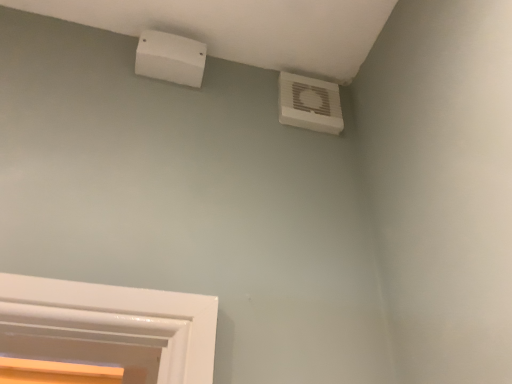
Question: Considering the relative sizes of white plastic air conditioning at upper left, which appears as the 1th air conditioning when viewed from the left, and white plastic air conditioning unit at upper right, positioned as the second air conditioning in left-to-right order, in the image provided, is white plastic air conditioning at upper left, which appears as the 1th air conditioning when viewed from the left, bigger than white plastic air conditioning unit at upper right, positioned as the second air conditioning in left-to-right order,?

Choices:
 (A) yes
 (B) no

Answer: (A)

Question: Considering the relative sizes of white plastic air conditioning at upper left, which is the 2th air conditioning in right-to-left order, and white plastic air conditioning unit at upper right, positioned as the second air conditioning in left-to-right order, in the image provided, is white plastic air conditioning at upper left, which is the 2th air conditioning in right-to-left order, wider than white plastic air conditioning unit at upper right, positioned as the second air conditioning in left-to-right order,?

Choices:
 (A) yes
 (B) no

Answer: (A)

Question: Does white plastic air conditioning at upper left, which is the 2th air conditioning in right-to-left order, touch white plastic air conditioning unit at upper right, which is the 1th air conditioning from right to left?

Choices:
 (A) yes
 (B) no

Answer: (B)

Question: Is white plastic air conditioning at upper left, which appears as the 1th air conditioning when viewed from the left, positioned behind white plastic air conditioning unit at upper right, which is the 1th air conditioning from right to left?

Choices:
 (A) no
 (B) yes

Answer: (A)

Question: Can you confirm if white plastic air conditioning at upper left, which appears as the 1th air conditioning when viewed from the left, is positioned to the right of white plastic air conditioning unit at upper right, positioned as the second air conditioning in left-to-right order?

Choices:
 (A) no
 (B) yes

Answer: (A)

Question: Considering the relative sizes of white plastic air conditioning at upper left, which appears as the 1th air conditioning when viewed from the left, and white plastic air conditioning unit at upper right, which is the 1th air conditioning from right to left, in the image provided, is white plastic air conditioning at upper left, which appears as the 1th air conditioning when viewed from the left, thinner than white plastic air conditioning unit at upper right, which is the 1th air conditioning from right to left,?

Choices:
 (A) no
 (B) yes

Answer: (A)

Question: Does white plastic air conditioning unit at upper right, positioned as the second air conditioning in left-to-right order, lie in front of white plastic air conditioning at upper left, which appears as the 1th air conditioning when viewed from the left?

Choices:
 (A) yes
 (B) no

Answer: (B)

Question: From a real-world perspective, does white plastic air conditioning unit at upper right, which is the 1th air conditioning from right to left, stand above white plastic air conditioning at upper left, which appears as the 1th air conditioning when viewed from the left?

Choices:
 (A) no
 (B) yes

Answer: (A)

Question: Is the depth of white plastic air conditioning unit at upper right, which is the 1th air conditioning from right to left, greater than that of white plastic air conditioning at upper left, which appears as the 1th air conditioning when viewed from the left?

Choices:
 (A) no
 (B) yes

Answer: (B)

Question: Does white plastic air conditioning unit at upper right, which is the 1th air conditioning from right to left, have a lesser width compared to white plastic air conditioning at upper left, which is the 2th air conditioning in right-to-left order?

Choices:
 (A) yes
 (B) no

Answer: (A)

Question: From a real-world perspective, is white plastic air conditioning unit at upper right, which is the 1th air conditioning from right to left, beneath white plastic air conditioning at upper left, which appears as the 1th air conditioning when viewed from the left?

Choices:
 (A) no
 (B) yes

Answer: (B)

Question: Is white plastic air conditioning unit at upper right, which is the 1th air conditioning from right to left, to the right of white plastic air conditioning at upper left, which is the 2th air conditioning in right-to-left order, from the viewer's perspective?

Choices:
 (A) no
 (B) yes

Answer: (B)

Question: From the image's perspective, relative to white plastic air conditioning unit at upper right, which is the 1th air conditioning from right to left, is white plastic air conditioning at upper left, which is the 2th air conditioning in right-to-left order, above or below?

Choices:
 (A) below
 (B) above

Answer: (B)